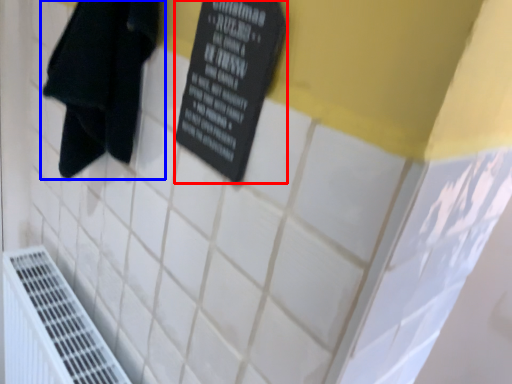
Question: Which object appears farthest to the camera in this image, bulletin board (highlighted by a red box) or towel (highlighted by a blue box)?

Choices:
 (A) bulletin board
 (B) towel

Answer: (B)